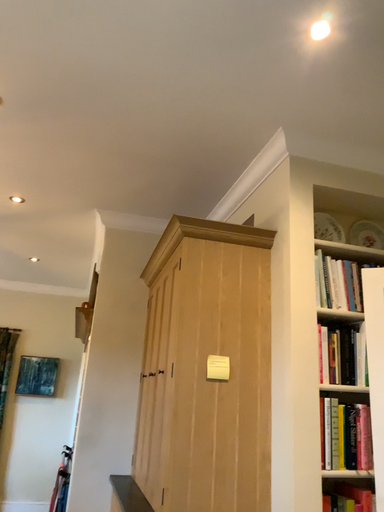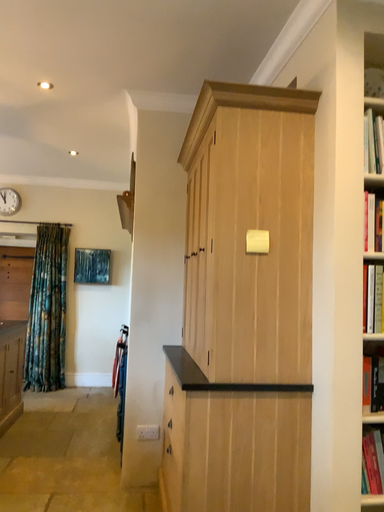
Question: How did the camera likely rotate when shooting the video?

Choices:
 (A) rotated downward
 (B) rotated upward

Answer: (A)